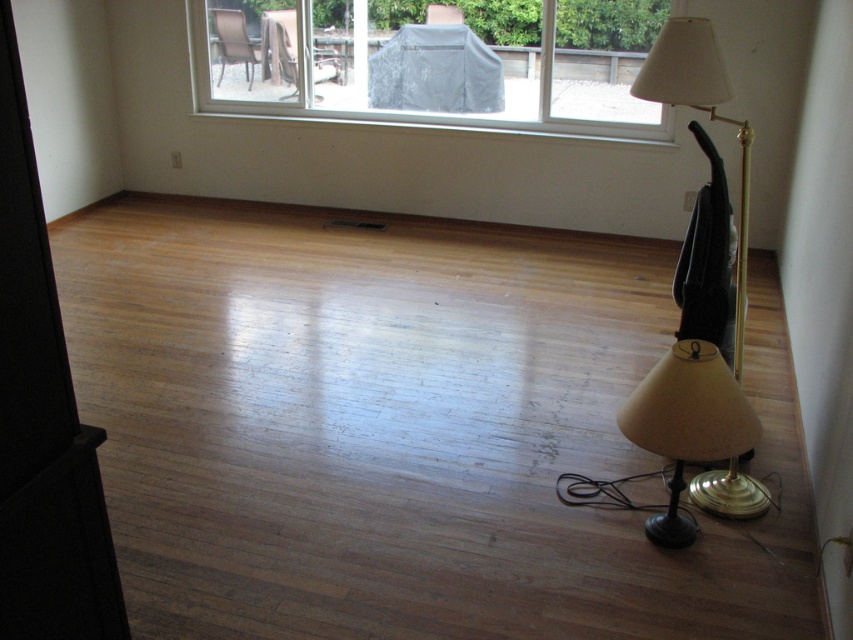
Can you confirm if matte gold lampshade at lower right is positioned above gold metallic floor lamp at right?

Actually, matte gold lampshade at lower right is below gold metallic floor lamp at right.

Measure the distance between matte gold lampshade at lower right and gold metallic floor lamp at right.

matte gold lampshade at lower right and gold metallic floor lamp at right are 20.10 inches apart from each other.

This screenshot has height=640, width=853. Find the location of `matte gold lampshade at lower right`. matte gold lampshade at lower right is located at coordinates (688, 422).

Can you confirm if matte gold lampshade at lower right is positioned below wooden textured chair at upper center?

Yes.

Is point (682, 426) positioned before point (343, 68)?

Yes, it is.

This screenshot has height=640, width=853. I want to click on matte gold lampshade at lower right, so coord(688,422).

Which is below, clear glass window at upper center or brown woven chair at upper left?

clear glass window at upper center

Between point (351, 58) and point (236, 12), which one is positioned in front?

Point (236, 12) is in front.

The width and height of the screenshot is (853, 640). What do you see at coordinates (432, 61) in the screenshot?
I see `clear glass window at upper center` at bounding box center [432, 61].

Where is `clear glass window at upper center`? This screenshot has height=640, width=853. clear glass window at upper center is located at coordinates click(432, 61).